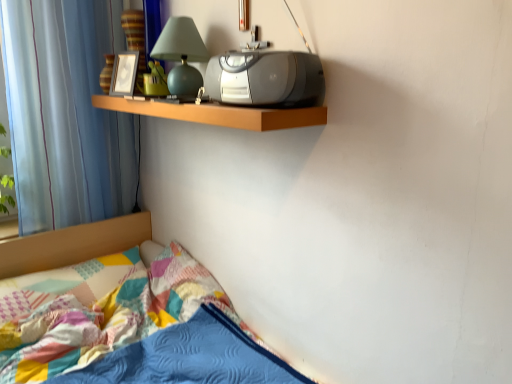
Question: Is matte green glass table lamp at upper center at the right side of green rubber duck at upper center?

Choices:
 (A) yes
 (B) no

Answer: (A)

Question: Does matte green glass table lamp at upper center have a greater height compared to green rubber duck at upper center?

Choices:
 (A) yes
 (B) no

Answer: (A)

Question: Is matte green glass table lamp at upper center located outside green rubber duck at upper center?

Choices:
 (A) yes
 (B) no

Answer: (A)

Question: Does matte green glass table lamp at upper center have a larger size compared to green rubber duck at upper center?

Choices:
 (A) yes
 (B) no

Answer: (A)

Question: Can you confirm if matte green glass table lamp at upper center is wider than green rubber duck at upper center?

Choices:
 (A) no
 (B) yes

Answer: (B)

Question: Relative to green rubber duck at upper center, is satin silver stereo at upper center in front or behind?

Choices:
 (A) behind
 (B) front

Answer: (B)

Question: From their relative heights in the image, would you say satin silver stereo at upper center is taller or shorter than green rubber duck at upper center?

Choices:
 (A) tall
 (B) short

Answer: (B)

Question: Is satin silver stereo at upper center to the left or to the right of green rubber duck at upper center in the image?

Choices:
 (A) left
 (B) right

Answer: (B)

Question: In terms of width, does satin silver stereo at upper center look wider or thinner when compared to green rubber duck at upper center?

Choices:
 (A) wide
 (B) thin

Answer: (A)

Question: Considering the positions of matte green glass table lamp at upper center and green rubber duck at upper center in the image, is matte green glass table lamp at upper center wider or thinner than green rubber duck at upper center?

Choices:
 (A) wide
 (B) thin

Answer: (A)

Question: Is matte green glass table lamp at upper center spatially inside green rubber duck at upper center, or outside of it?

Choices:
 (A) outside
 (B) inside

Answer: (A)

Question: From the image's perspective, is matte green glass table lamp at upper center above or below green rubber duck at upper center?

Choices:
 (A) below
 (B) above

Answer: (B)

Question: Considering the relative positions of matte green glass table lamp at upper center and green rubber duck at upper center in the image provided, is matte green glass table lamp at upper center to the left or to the right of green rubber duck at upper center?

Choices:
 (A) left
 (B) right

Answer: (B)

Question: Based on their sizes in the image, would you say blue sheer curtain at left is bigger or smaller than green rubber duck at upper center?

Choices:
 (A) small
 (B) big

Answer: (B)

Question: Is blue sheer curtain at left taller or shorter than green rubber duck at upper center?

Choices:
 (A) tall
 (B) short

Answer: (A)